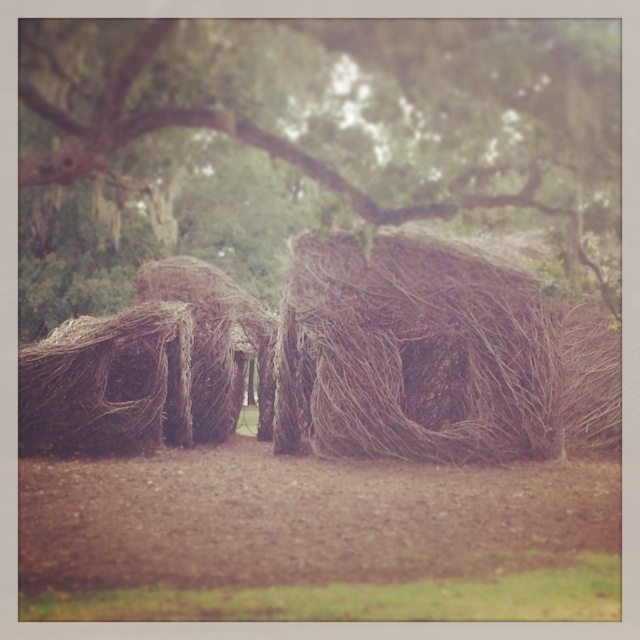
You are standing in a forest and see the brown woven structure at center. If you were to draw a straight line from your current position to the structure, what coordinates would mark its center?

The center of the brown woven structure at center is located at coordinates point (340, 113).